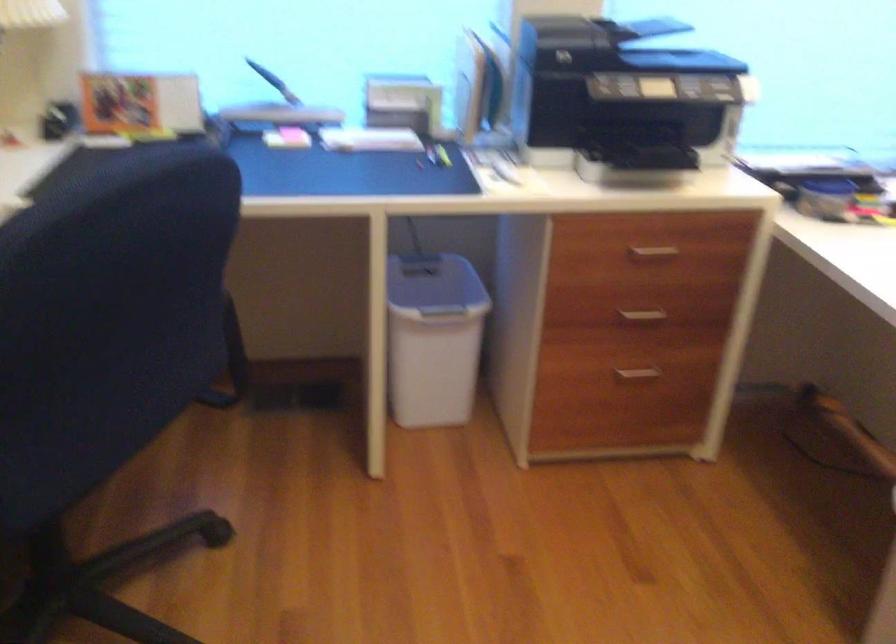
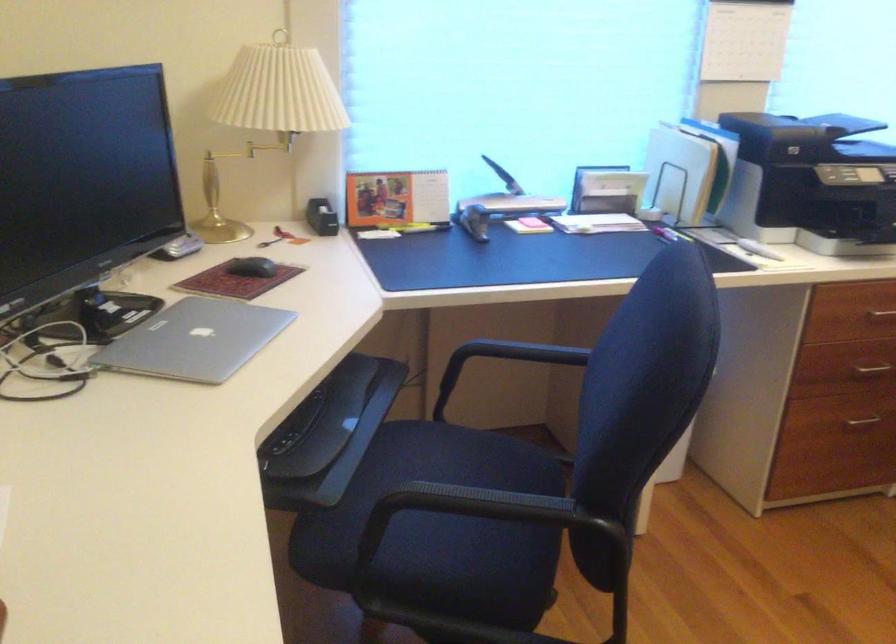
Find the pixel in the second image that matches point (268, 114) in the first image.

(502, 205)